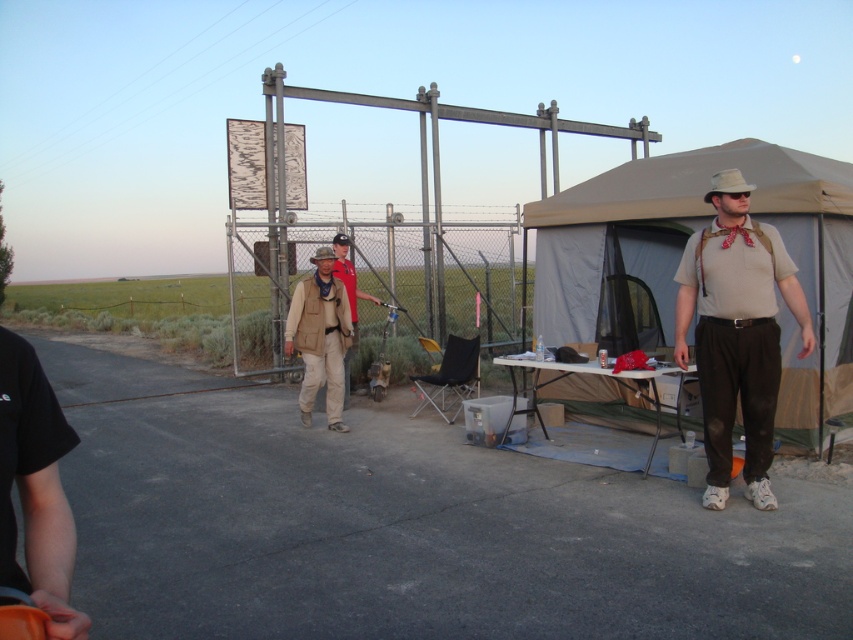
Question: Estimate the real-world distances between objects in this image. Which object is farther from the matte khaki shirt at right?

Choices:
 (A) red shirt at center
 (B) tan canvas tent at right
 (C) tan fabric vest at center

Answer: (A)

Question: Does tan canvas tent at right appear under matte khaki shirt at right?

Choices:
 (A) no
 (B) yes

Answer: (B)

Question: Considering the real-world distances, which object is farthest from the tan canvas tent at right?

Choices:
 (A) red shirt at center
 (B) matte khaki shirt at right

Answer: (A)

Question: Which point is farther to the camera?

Choices:
 (A) (805, 234)
 (B) (332, 337)

Answer: (B)

Question: Does tan canvas tent at right appear under tan fabric vest at center?

Choices:
 (A) no
 (B) yes

Answer: (B)

Question: Where is tan canvas tent at right located in relation to tan fabric vest at center in the image?

Choices:
 (A) above
 (B) below

Answer: (B)